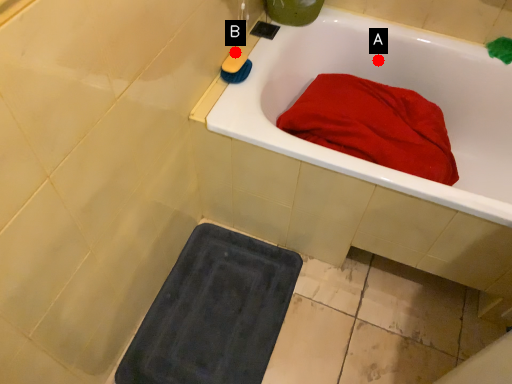
Question: Two points are circled on the image, labeled by A and B beside each circle. Which point is farther from the camera taking this photo?

Choices:
 (A) A is further
 (B) B is further

Answer: (A)